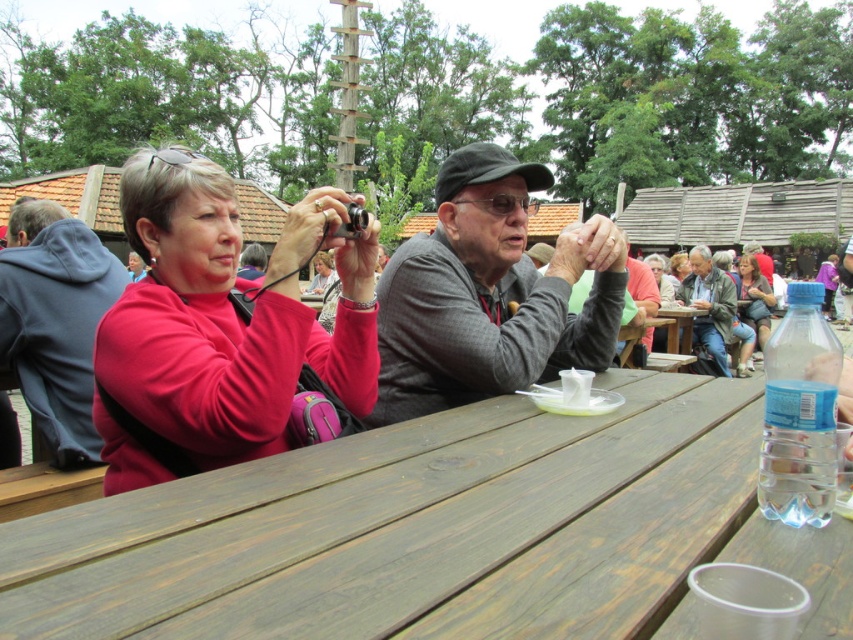
Question: Estimate the real-world distances between objects in this image. Which object is closer to the wooden table at center?

Choices:
 (A) matte pink sweater at upper center
 (B) gray woolen sweater at center

Answer: (A)

Question: Is weathered wood table at center below leather jacket at center?

Choices:
 (A) no
 (B) yes

Answer: (B)

Question: Which object is farther from the camera taking this photo?

Choices:
 (A) weathered wood table at center
 (B) leather jacket at center
 (C) denim jacket at upper right
 (D) gray woolen sweater at center

Answer: (C)

Question: Which point is closer to the camera taking this photo?

Choices:
 (A) (300, 248)
 (B) (722, 312)
 (C) (426, 291)
 (D) (68, 326)

Answer: (A)

Question: Is wooden table at center to the right of purple fabric dress at center from the viewer's perspective?

Choices:
 (A) yes
 (B) no

Answer: (B)

Question: Does matte pink hoodie at left appear on the right side of leather jacket at center?

Choices:
 (A) no
 (B) yes

Answer: (A)